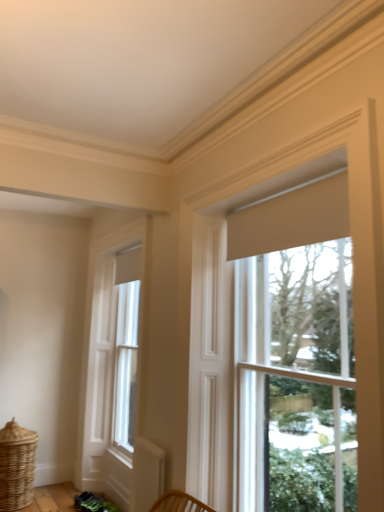
This screenshot has width=384, height=512. I want to click on matte cream roller shade at right, which ranks as the 2th window in back-to-front order, so click(295, 352).

The height and width of the screenshot is (512, 384). What are the coordinates of `matte cream roller shade at right, which ranks as the 2th window in back-to-front order` in the screenshot? It's located at click(295, 352).

Is there a large distance between woven natural basket at lower left and beige fabric curtain at upper center?

That's right, there is a large distance between woven natural basket at lower left and beige fabric curtain at upper center.

Between woven natural basket at lower left and beige fabric curtain at upper center, which one has less height?

With less height is beige fabric curtain at upper center.

Is woven natural basket at lower left aimed at beige fabric curtain at upper center?

No, woven natural basket at lower left does not turn towards beige fabric curtain at upper center.

The image size is (384, 512). Identify the location of basket that is below the white wood window at left, which is the 2th window in front-to-back order (from the image's perspective). (16, 466).

Could you tell me if white wood window at left, marked as the 1th window in a back-to-front arrangement, is turned towards woven natural basket at lower left?

Yes.

Which object is thinner, white wood window at left, which is the 2th window in front-to-back order, or woven natural basket at lower left?

white wood window at left, which is the 2th window in front-to-back order, is thinner.

Considering the relative sizes of white wood window at left, marked as the 1th window in a back-to-front arrangement, and woven natural basket at lower left in the image provided, is white wood window at left, marked as the 1th window in a back-to-front arrangement, taller than woven natural basket at lower left?

Indeed, white wood window at left, marked as the 1th window in a back-to-front arrangement, has a greater height compared to woven natural basket at lower left.

From the image's perspective, which one is positioned higher, beige fabric curtain at upper center or woven natural basket at lower left?

beige fabric curtain at upper center is shown above in the image.

Is woven natural basket at lower left at the back of beige fabric curtain at upper center?

beige fabric curtain at upper center does not have its back to woven natural basket at lower left.

Who is bigger, beige fabric curtain at upper center or woven natural basket at lower left?

woven natural basket at lower left is bigger.

What's the angular difference between beige fabric curtain at upper center and matte cream roller shade at right, which appears as the first window when viewed from the front,'s facing directions?

0.00301 degrees separate the facing orientations of beige fabric curtain at upper center and matte cream roller shade at right, which appears as the first window when viewed from the front.

From a real-world perspective, is beige fabric curtain at upper center located higher than matte cream roller shade at right, the 2th window viewed from the left?

Yes, from a real-world perspective, beige fabric curtain at upper center is above matte cream roller shade at right, the 2th window viewed from the left.

Is beige fabric curtain at upper center taller or shorter than matte cream roller shade at right, which is the 1th window from right to left?

beige fabric curtain at upper center is shorter than matte cream roller shade at right, which is the 1th window from right to left.

From a real-world perspective, starting from the beige fabric curtain at upper center, which window is the 1st one below it? Please provide its 2D coordinates.

[(295, 352)]

How many degrees apart are the facing directions of matte cream roller shade at right, which appears as the first window when viewed from the front, and white wood window at left, which is the 2th window in front-to-back order?

0.625 degrees.

Does matte cream roller shade at right, which is the 1th window from right to left, have a greater width compared to white wood window at left, marked as the 1th window in a back-to-front arrangement?

Yes.

Which of these two, matte cream roller shade at right, which ranks as the 2th window in back-to-front order, or white wood window at left, which is the 2th window in front-to-back order, stands taller?

white wood window at left, which is the 2th window in front-to-back order, is taller.

Could you tell me if matte cream roller shade at right, which ranks as the 2th window in back-to-front order, is turned towards white wood window at left, positioned as the 2th window in right-to-left order?

No, matte cream roller shade at right, which ranks as the 2th window in back-to-front order, does not turn towards white wood window at left, positioned as the 2th window in right-to-left order.

Would you say beige fabric curtain at upper center is part of matte cream roller shade at right, which is the 1th window from right to left,'s contents?

No, beige fabric curtain at upper center is located outside of matte cream roller shade at right, which is the 1th window from right to left.

Considering the sizes of objects matte cream roller shade at right, which is the 1th window from right to left, and beige fabric curtain at upper center in the image provided, who is taller, matte cream roller shade at right, which is the 1th window from right to left, or beige fabric curtain at upper center?

With more height is matte cream roller shade at right, which is the 1th window from right to left.

Considering the sizes of objects matte cream roller shade at right, which ranks as the 2th window in back-to-front order, and beige fabric curtain at upper center in the image provided, who is bigger, matte cream roller shade at right, which ranks as the 2th window in back-to-front order, or beige fabric curtain at upper center?

With larger size is matte cream roller shade at right, which ranks as the 2th window in back-to-front order.

From the image's perspective, between matte cream roller shade at right, which appears as the first window when viewed from the front, and beige fabric curtain at upper center, which one is located above?

beige fabric curtain at upper center appears higher in the image.

Is white wood window at left, marked as the 1th window in a back-to-front arrangement, thinner than matte cream roller shade at right, which is the 1th window from right to left?

Yes, white wood window at left, marked as the 1th window in a back-to-front arrangement, is thinner than matte cream roller shade at right, which is the 1th window from right to left.

From a real-world perspective, between white wood window at left, which appears as the 1th window when viewed from the left, and matte cream roller shade at right, which is the 1th window from right to left, who is vertically lower?

white wood window at left, which appears as the 1th window when viewed from the left, is physically lower.

Considering the positions of objects white wood window at left, which appears as the 1th window when viewed from the left, and matte cream roller shade at right, which appears as the first window when viewed from the front, in the image provided, who is in front, white wood window at left, which appears as the 1th window when viewed from the left, or matte cream roller shade at right, which appears as the first window when viewed from the front,?

matte cream roller shade at right, which appears as the first window when viewed from the front, is closer to the camera.

Is white wood window at left, which appears as the 1th window when viewed from the left, positioned beyond the bounds of matte cream roller shade at right, which is the 1th window from right to left?

white wood window at left, which appears as the 1th window when viewed from the left, lies outside matte cream roller shade at right, which is the 1th window from right to left,'s area.

Locate an element on the screen. basket behind the beige fabric curtain at upper center is located at coordinates (16, 466).

Image resolution: width=384 pixels, height=512 pixels. Find the location of `the 1st window counting from the right side of the woven natural basket at lower left`. the 1st window counting from the right side of the woven natural basket at lower left is located at coordinates (114, 361).

In the scene shown: Based on their spatial positions, is matte cream roller shade at right, the 2th window viewed from the left, or beige fabric curtain at upper center further from white wood window at left, which is the 2th window in front-to-back order?

beige fabric curtain at upper center.

From the image, which object appears to be nearer to woven natural basket at lower left, matte cream roller shade at right, which appears as the first window when viewed from the front, or beige fabric curtain at upper center?

matte cream roller shade at right, which appears as the first window when viewed from the front.

Estimate the real-world distances between objects in this image. Which object is further from woven natural basket at lower left, white wood window at left, marked as the 1th window in a back-to-front arrangement, or beige fabric curtain at upper center?

Based on the image, beige fabric curtain at upper center appears to be further to woven natural basket at lower left.

From the image, which object appears to be farther from matte cream roller shade at right, the 2th window viewed from the left, white wood window at left, which appears as the 1th window when viewed from the left, or woven natural basket at lower left?

Based on the image, woven natural basket at lower left appears to be further to matte cream roller shade at right, the 2th window viewed from the left.

Which object lies nearer to the anchor point beige fabric curtain at upper center, white wood window at left, which is the 2th window in front-to-back order, or matte cream roller shade at right, which appears as the first window when viewed from the front?

matte cream roller shade at right, which appears as the first window when viewed from the front, lies closer to beige fabric curtain at upper center than the other object.

Considering their positions, is white wood window at left, which is the 2th window in front-to-back order, positioned further to matte cream roller shade at right, which ranks as the 2th window in back-to-front order, than beige fabric curtain at upper center?

white wood window at left, which is the 2th window in front-to-back order.

Considering their positions, is white wood window at left, positioned as the 2th window in right-to-left order, positioned further to beige fabric curtain at upper center than woven natural basket at lower left?

Based on the image, woven natural basket at lower left appears to be further to beige fabric curtain at upper center.

When comparing their distances from white wood window at left, positioned as the 2th window in right-to-left order, does beige fabric curtain at upper center or matte cream roller shade at right, which appears as the first window when viewed from the front, seem further?

beige fabric curtain at upper center.

At what (x,y) coordinates should I click in order to perform the action: click on curtain between matte cream roller shade at right, which appears as the first window when viewed from the front, and white wood window at left, which is the 2th window in front-to-back order, in the front-back direction. Please return your answer as a coordinate pair (x, y). The height and width of the screenshot is (512, 384). Looking at the image, I should click on point(291,219).

At what (x,y) coordinates should I click in order to perform the action: click on curtain between woven natural basket at lower left and matte cream roller shade at right, the 2th window viewed from the left, from left to right. Please return your answer as a coordinate pair (x, y). Looking at the image, I should click on (291, 219).

The image size is (384, 512). I want to click on window between woven natural basket at lower left and beige fabric curtain at upper center in the horizontal direction, so click(114, 361).

You are a GUI agent. You are given a task and a screenshot of the screen. Output one action in this format:
    pyautogui.click(x=<x>, y=<y>)
    Task: Click on the window located between woven natural basket at lower left and matte cream roller shade at right, which appears as the first window when viewed from the front, in the left-right direction
    This screenshot has height=512, width=384.
    Given the screenshot: What is the action you would take?
    pyautogui.click(x=114, y=361)